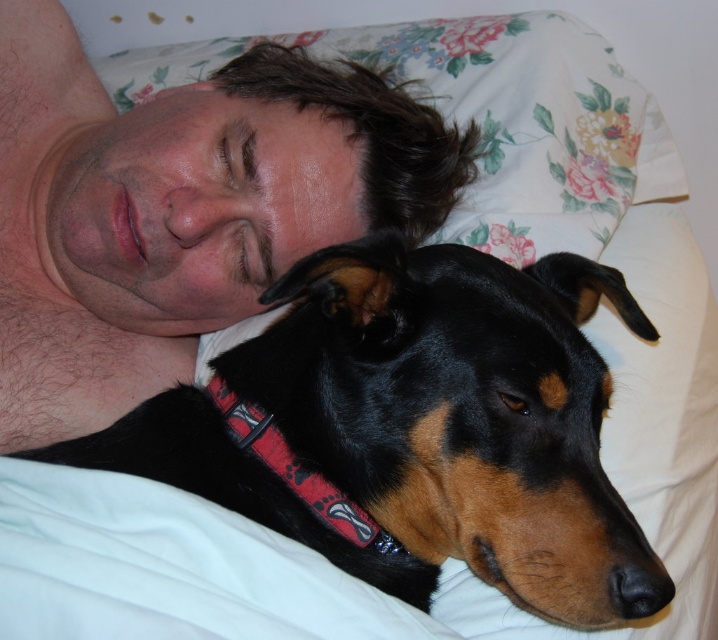
Question: Does hairless skin at upper center appear on the right side of red fabric neckband at lower center?

Choices:
 (A) yes
 (B) no

Answer: (B)

Question: Which of these objects is positioned farthest from the red fabric neckband at lower center?

Choices:
 (A) hairless skin at upper center
 (B) black shiny dog at center

Answer: (A)

Question: Which of the following is the farthest from the observer?

Choices:
 (A) (314, 493)
 (B) (428, 400)
 (C) (332, 120)

Answer: (C)

Question: Can you confirm if hairless skin at upper center is positioned above red fabric neckband at lower center?

Choices:
 (A) no
 (B) yes

Answer: (B)

Question: Is black shiny dog at center smaller than red fabric neckband at lower center?

Choices:
 (A) no
 (B) yes

Answer: (A)

Question: Based on their relative distances, which object is farther from the black shiny dog at center?

Choices:
 (A) hairless skin at upper center
 (B) red fabric neckband at lower center

Answer: (A)